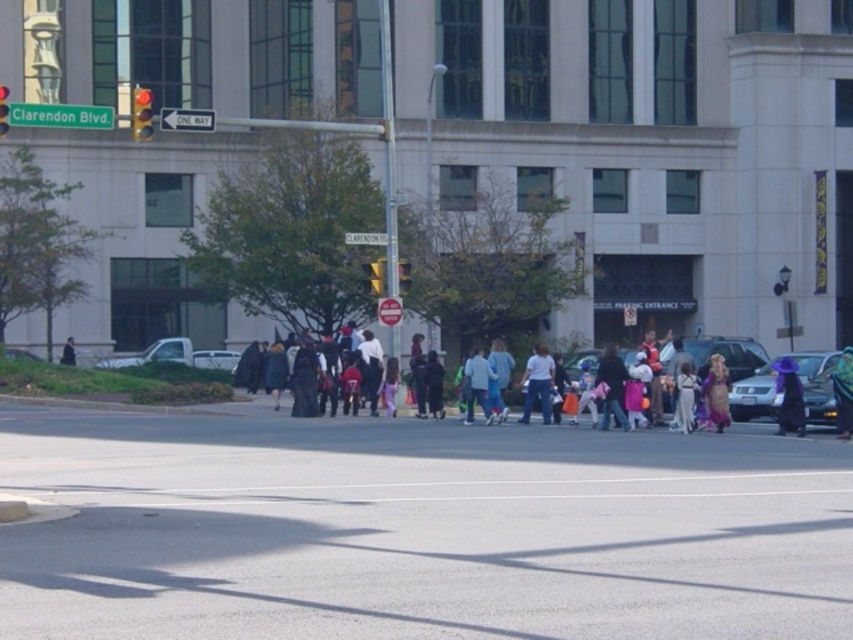
You are a delivery driver who needs to park your metallic silver suv at center near the yellow plastic traffic light at upper left. Based on the scene description, can your suv fit in the available space next to the traffic light?

The metallic silver suv at center occupies less space than the yellow plastic traffic light at upper left, so yes, the suv can fit in the available space next to the traffic light since it is smaller in size.